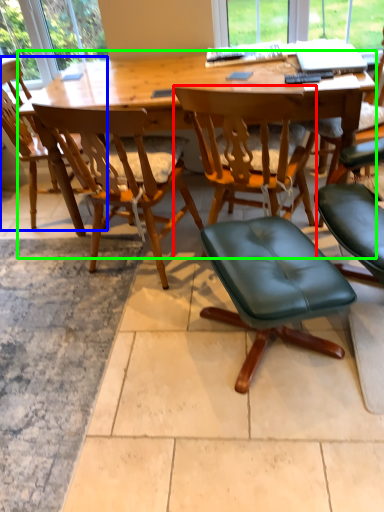
Question: Which object is the farthest from chair (highlighted by a red box)? Choose among these: chair (highlighted by a blue box) or desk (highlighted by a green box).

Choices:
 (A) chair
 (B) desk

Answer: (A)